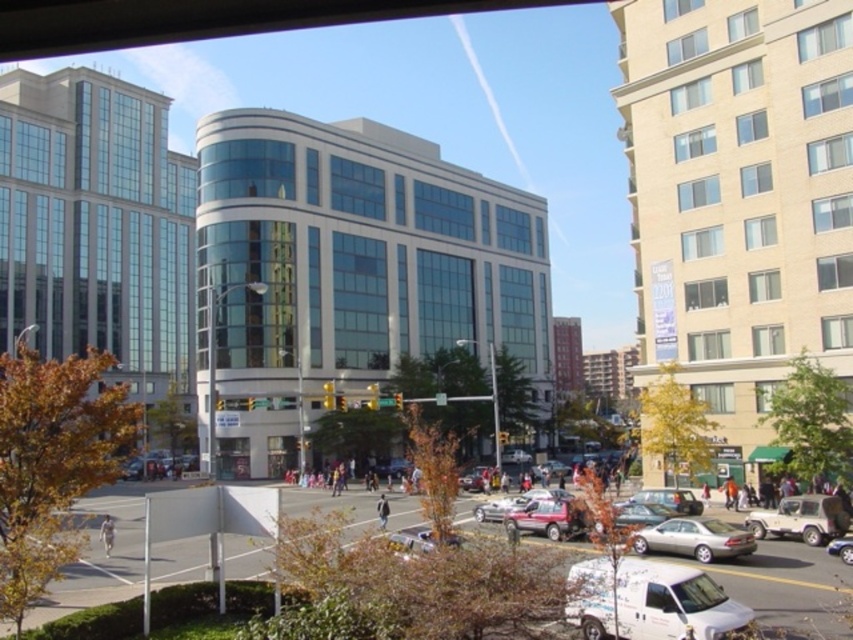
You are a delivery person who needs to place a large package in the area shown. The package is as wide as the light brown leather jacket at lower left. Is there enough space between the metallic silver sedan at lower center and the nearby trees to safely place the package without touching the sedan?

The metallic silver sedan at lower center is wider than the light brown leather jacket at lower left. Since the package is as wide as the light brown leather jacket at lower left, there should be sufficient space between the metallic silver sedan at lower center and the trees to place the package without touching the sedan.

You are a pedestrian standing at the intersection and see the metallic silver car at center and the dark blue jeans at center. Which object is larger in size?

The metallic silver car at center is bigger than dark blue jeans at center.

You are standing at the origin of the coordinate system in the image. You see two points labeled as point (653, 497) and point (111, 518). Which point is closer to you?

Point (653, 497) is in front of point (111, 518), so it is closer to you.